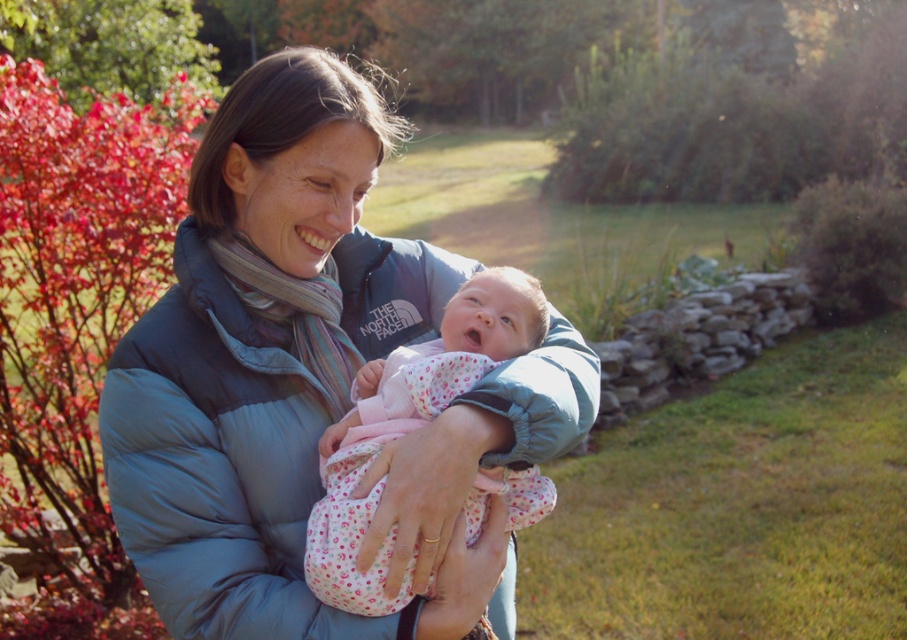
Question: Which point is closer to the camera taking this photo?

Choices:
 (A) (496, 285)
 (B) (398, 627)

Answer: (B)

Question: Does matte blue down jacket at center have a larger size compared to floral fabric baby at center?

Choices:
 (A) no
 (B) yes

Answer: (B)

Question: Which object is farther from the camera taking this photo?

Choices:
 (A) matte blue down jacket at center
 (B) floral fabric baby at center

Answer: (A)

Question: Can you confirm if matte blue down jacket at center is bigger than floral fabric baby at center?

Choices:
 (A) no
 (B) yes

Answer: (B)

Question: Does matte blue down jacket at center appear over floral fabric baby at center?

Choices:
 (A) yes
 (B) no

Answer: (A)